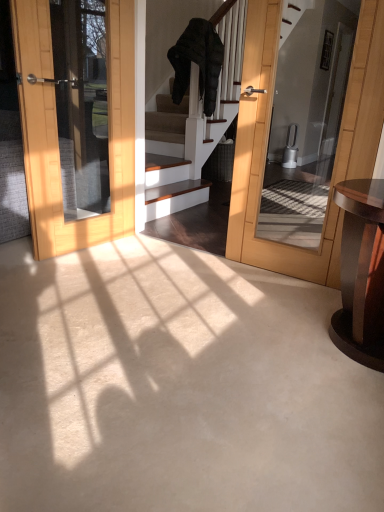
The height and width of the screenshot is (512, 384). What do you see at coordinates (197, 62) in the screenshot?
I see `dark gray puffer jacket at center` at bounding box center [197, 62].

Where is `dark gray puffer jacket at center`? The height and width of the screenshot is (512, 384). dark gray puffer jacket at center is located at coordinates (197, 62).

Locate an element on the screen. dark wood table at right is located at coordinates (361, 273).

This screenshot has height=512, width=384. What do you see at coordinates (361, 273) in the screenshot? I see `dark wood table at right` at bounding box center [361, 273].

Locate an element on the screen. dark gray puffer jacket at center is located at coordinates (197, 62).

Would you say dark gray puffer jacket at center is to the left or to the right of dark wood table at right in the picture?

From the image, it's evident that dark gray puffer jacket at center is to the left of dark wood table at right.

Which object is further away from the camera taking this photo, dark gray puffer jacket at center or dark wood table at right?

Positioned behind is dark gray puffer jacket at center.

Is point (184, 71) less distant than point (341, 206)?

No.

From the image's perspective, is dark gray puffer jacket at center located above dark wood table at right?

Yes, from the image's perspective, dark gray puffer jacket at center is on top of dark wood table at right.

From a real-world perspective, is dark gray puffer jacket at center beneath dark wood table at right?

Incorrect, from a real-world perspective, dark gray puffer jacket at center is higher than dark wood table at right.

Considering the sizes of objects dark gray puffer jacket at center and dark wood table at right in the image provided, who is wider, dark gray puffer jacket at center or dark wood table at right?

Wider between the two is dark wood table at right.

Which of these two, dark gray puffer jacket at center or dark wood table at right, stands shorter?

Standing shorter between the two is dark wood table at right.

Does dark gray puffer jacket at center have a larger size compared to dark wood table at right?

Correct, dark gray puffer jacket at center is larger in size than dark wood table at right.

Is dark gray puffer jacket at center inside the boundaries of dark wood table at right, or outside?

dark gray puffer jacket at center lies outside dark wood table at right.

Is dark gray puffer jacket at center next to dark wood table at right?

No, dark gray puffer jacket at center is not beside dark wood table at right.

Is dark gray puffer jacket at center facing away from dark wood table at right?

No, dark gray puffer jacket at center is not facing away from dark wood table at right.

Identify the location of robe above the dark wood table at right (from a real-world perspective). (197, 62).

Consider the image. Between dark wood table at right and dark gray puffer jacket at center, which one appears on the left side from the viewer's perspective?

From the viewer's perspective, dark gray puffer jacket at center appears more on the left side.

Is dark wood table at right in front of dark gray puffer jacket at center?

Yes, it is.

Is point (352, 237) positioned after point (172, 51)?

That is False.

From the image's perspective, is dark wood table at right on top of dark gray puffer jacket at center?

No, from the image's perspective, dark wood table at right is not above dark gray puffer jacket at center.

From a real-world perspective, is dark wood table at right positioned above or below dark gray puffer jacket at center?

dark wood table at right is situated lower than dark gray puffer jacket at center in the real world.

Between dark wood table at right and dark gray puffer jacket at center, which one has larger width?

dark wood table at right is wider.

Who is taller, dark wood table at right or dark gray puffer jacket at center?

dark gray puffer jacket at center is taller.

Is dark wood table at right bigger or smaller than dark gray puffer jacket at center?

Clearly, dark wood table at right is smaller in size than dark gray puffer jacket at center.

Is dark wood table at right positioned beyond the bounds of dark gray puffer jacket at center?

Absolutely, dark wood table at right is external to dark gray puffer jacket at center.

Are dark wood table at right and dark gray puffer jacket at center far apart?

That's right, there is a large distance between dark wood table at right and dark gray puffer jacket at center.

Could you tell me if dark wood table at right is facing dark gray puffer jacket at center?

No.

How different are the orientations of dark wood table at right and dark gray puffer jacket at center in degrees?

There is a 86.6-degree angle between the facing directions of dark wood table at right and dark gray puffer jacket at center.

Image resolution: width=384 pixels, height=512 pixels. What are the coordinates of `table that is in front of the dark gray puffer jacket at center` in the screenshot? It's located at (361, 273).

Identify the location of robe behind the dark wood table at right. (197, 62).

What are the coordinates of `table located below the dark gray puffer jacket at center (from the image's perspective)` in the screenshot? It's located at (x=361, y=273).